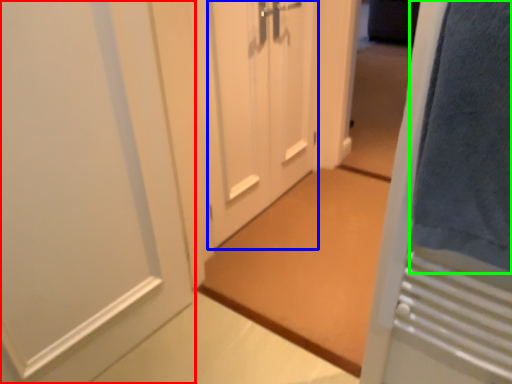
Question: Which object is the farthest from door (highlighted by a red box)? Choose among these: door (highlighted by a blue box) or bath towel (highlighted by a green box).

Choices:
 (A) door
 (B) bath towel

Answer: (B)